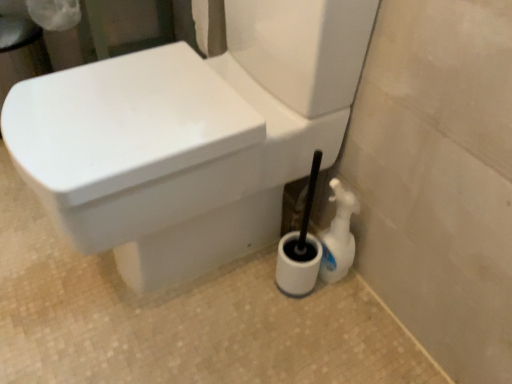
Question: Considering the positions of white glossy toilet at center and white plastic spray bottle at lower right in the image, is white glossy toilet at center wider or thinner than white plastic spray bottle at lower right?

Choices:
 (A) thin
 (B) wide

Answer: (B)

Question: Considering the positions of white glossy toilet at center and white plastic spray bottle at lower right in the image, is white glossy toilet at center taller or shorter than white plastic spray bottle at lower right?

Choices:
 (A) short
 (B) tall

Answer: (B)

Question: Considering their positions, is white glossy toilet at center located in front of or behind white plastic spray bottle at lower right?

Choices:
 (A) front
 (B) behind

Answer: (A)

Question: Is white plastic spray bottle at lower right inside the boundaries of white glossy toilet at center, or outside?

Choices:
 (A) inside
 (B) outside

Answer: (B)

Question: From a real-world perspective, is white plastic spray bottle at lower right above or below white glossy toilet at center?

Choices:
 (A) below
 (B) above

Answer: (A)

Question: Looking at their shapes, would you say white plastic spray bottle at lower right is wider or thinner than white glossy toilet at center?

Choices:
 (A) wide
 (B) thin

Answer: (B)

Question: From the image's perspective, relative to white glossy toilet at center, is white plastic spray bottle at lower right above or below?

Choices:
 (A) below
 (B) above

Answer: (A)